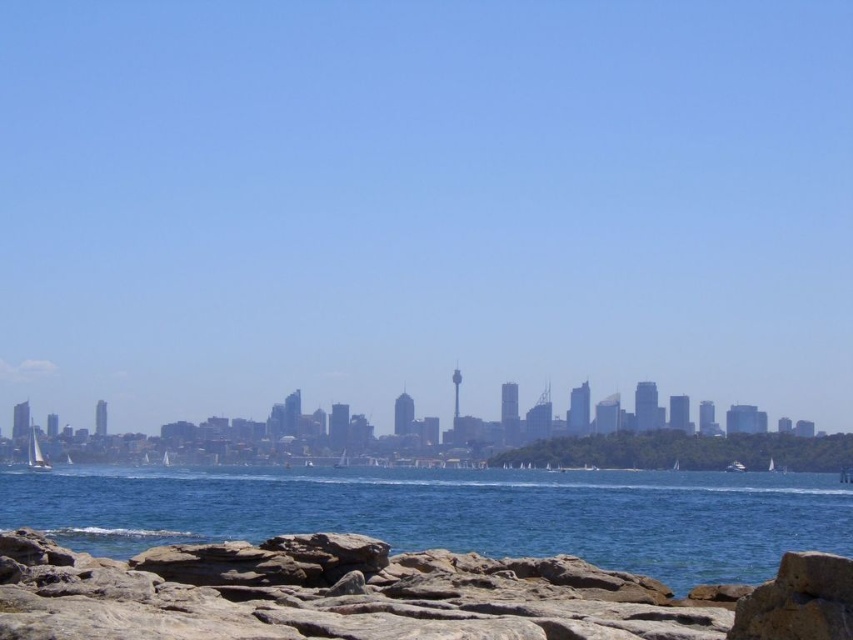
Question: Which of these objects is positioned farthest from the white sailboat at lower left?

Choices:
 (A) rusty stone rocks at lower left
 (B) blue water at lower center

Answer: (A)

Question: Is blue water at lower center to the left of white sailboat at lower left from the viewer's perspective?

Choices:
 (A) yes
 (B) no

Answer: (B)

Question: Can you confirm if rusty stone rocks at lower left is thinner than blue water at lower center?

Choices:
 (A) no
 (B) yes

Answer: (B)

Question: Which point is closer to the camera?

Choices:
 (A) blue water at lower center
 (B) rusty stone rocks at lower left

Answer: (B)

Question: Does blue water at lower center appear under white sailboat at lower left?

Choices:
 (A) no
 (B) yes

Answer: (A)

Question: Which object appears farthest from the camera in this image?

Choices:
 (A) white sailboat at lower left
 (B) blue water at lower center

Answer: (A)